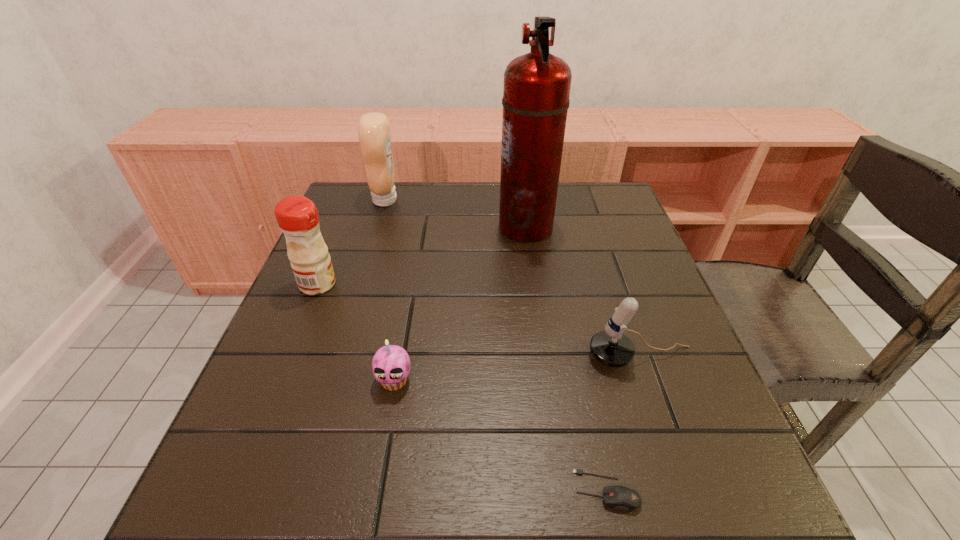
Identify which object is the fifth closest to the cupcake. Please provide its 2D coordinates. Your answer should be formatted as a tuple, i.e. [(x, y)], where the tuple contains the x and y coordinates of a point satisfying the conditions above.

[(374, 131)]

Point out which object is positioned as the second nearest to the right condiment. Please provide its 2D coordinates. Your answer should be formatted as a tuple, i.e. [(x, y)], where the tuple contains the x and y coordinates of a point satisfying the conditions above.

[(536, 91)]

Find the location of a particular element. The image size is (960, 540). vacant area that satisfies the following two spatial constraints: 1. on the side of the microphone with the handle and hose; 2. on the left side of the tallest object is located at coordinates (543, 357).

The height and width of the screenshot is (540, 960). Identify the location of free space that satisfies the following two spatial constraints: 1. on the side of the tallest object with the handle and hose; 2. on the face of the fifth tallest object. (546, 380).

Find the location of `blank area in the image that satisfies the following two spatial constraints: 1. on the side of the tallest object with the handle and hose; 2. on the left side of the shortest object`. blank area in the image that satisfies the following two spatial constraints: 1. on the side of the tallest object with the handle and hose; 2. on the left side of the shortest object is located at coordinates (562, 490).

In order to click on vacant region that satisfies the following two spatial constraints: 1. on the side of the fire extinguisher with the handle and hose; 2. on the front side of the third farthest object in this screenshot , I will do `click(534, 284)`.

The width and height of the screenshot is (960, 540). In order to click on free space that satisfies the following two spatial constraints: 1. on the back side of the microphone; 2. on the side of the tallest object with the handle and hose in this screenshot , I will do `click(596, 227)`.

The height and width of the screenshot is (540, 960). What are the coordinates of `vacant position in the image that satisfies the following two spatial constraints: 1. on the label of the second object from left to right; 2. on the left side of the third shortest object` in the screenshot? It's located at (337, 357).